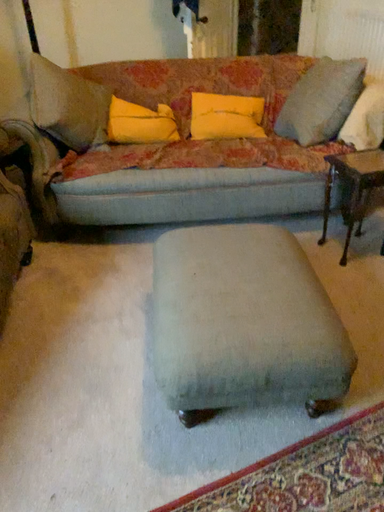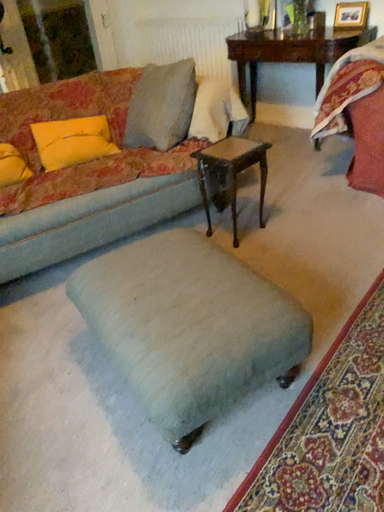
Question: Which way did the camera rotate in the video?

Choices:
 (A) rotated right
 (B) rotated left

Answer: (A)